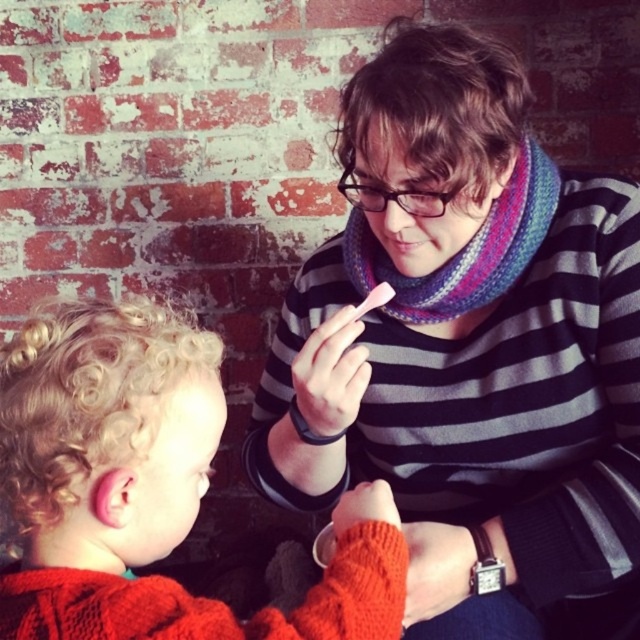
Which is more to the left, cabled knit sweater at lower left or knitted multicolored scarf at center?

cabled knit sweater at lower left

Is point (42, 632) positioned behind point (513, 205)?

No.

This screenshot has width=640, height=640. In order to click on cabled knit sweater at lower left in this screenshot , I will do `click(141, 486)`.

Who is positioned more to the left, striped sweater at center or knitted multicolored scarf at center?

striped sweater at center

Does striped sweater at center appear on the left side of knitted multicolored scarf at center?

Yes, striped sweater at center is to the left of knitted multicolored scarf at center.

Does point (636, 410) lie in front of point (496, 285)?

That is True.

The image size is (640, 640). In order to click on striped sweater at center in this screenshot , I will do `click(465, 344)`.

Is striped sweater at center taller than pink matte lips at center?

Yes.

Does point (528, 282) lie behind point (426, 240)?

Yes.

Locate an element on the screen. Image resolution: width=640 pixels, height=640 pixels. striped sweater at center is located at coordinates (465, 344).